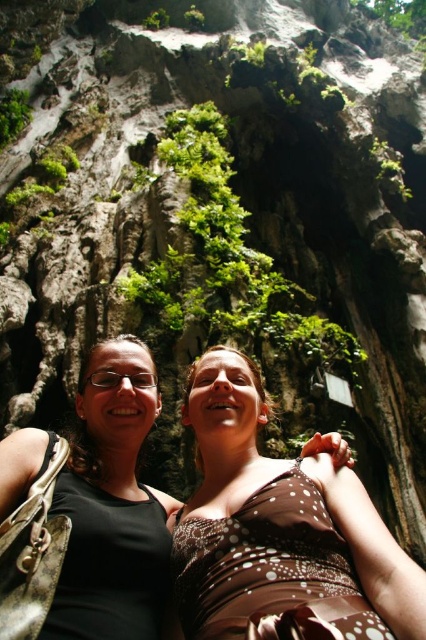
You are taking a photo of two people standing in front of a cliff. You want to focus on the person wearing the brown dotted dress at center. Which side of the black fabric at center should you position your camera to capture them?

The brown dotted dress at center is to the right of the black fabric at center, so you should position your camera to the right side of the black fabric at center to capture the person in the brown dotted dress at center.

You are a photographer trying to capture a photo of the two people standing in front of the cliff. You notice the brown dotted dress at center and the black fabric at center. Which clothing item is shorter in height?

The brown dotted dress at center has a lesser height compared to the black fabric at center, so the brown dotted dress at center is shorter in height.